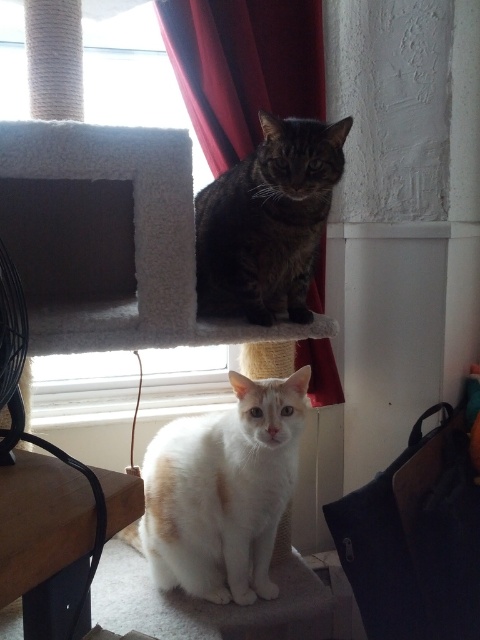
You are standing in front of the scene with two cats. You want to take a photo of the point at coordinate point (311, 355). Is the point within your camera frame?

The point (311, 355) is 5.56 feet from the camera, so it is within the camera frame as it is at a reasonable distance.

Consider the image. You are a cat owner who wants to place a toy between the white fluffy cat at lower center and the tabby fur cat at upper center. Which cat is closer to you so the toy can be placed in front of them?

The white fluffy cat at lower center is closer to you, so placing the toy in front of them would be appropriate.

You are a photographer trying to capture the tabby fur cat at upper center. The red velvet curtain at upper center is blocking your view. Can you move the curtain to the side to get a clear shot of the cat?

The red velvet curtain at upper center is positioned over the tabby fur cat at upper center, so moving the curtain aside would allow you to see the cat clearly.